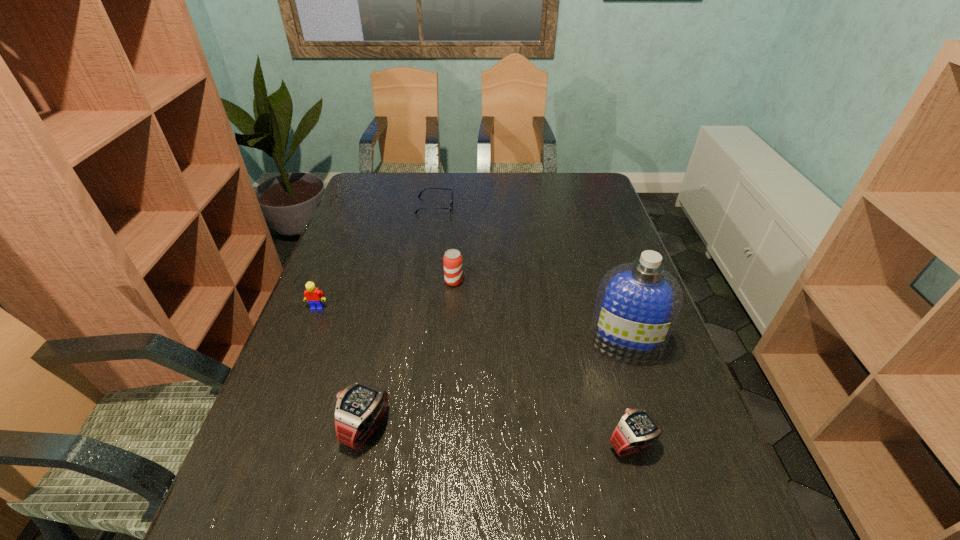
Identify the location of vacant region located on the right of the right watch. Image resolution: width=960 pixels, height=540 pixels. (687, 444).

Where is `vacant space located on the front-facing side of the spectacles`? The image size is (960, 540). vacant space located on the front-facing side of the spectacles is located at coordinates (520, 205).

In order to click on free space located on the back of the fifth nearest object in this screenshot , I will do `click(458, 218)`.

Locate an element on the screen. The image size is (960, 540). vacant space positioned 0.100m on the left of the cleansing agent is located at coordinates (548, 343).

At what (x,y) coordinates should I click in order to perform the action: click on vacant space located 0.300m on the front-facing side of the leftmost object. Please return your answer as a coordinate pair (x, y). The height and width of the screenshot is (540, 960). Looking at the image, I should click on (277, 410).

Locate an element on the screen. The image size is (960, 540). object that is positioned at the far edge is located at coordinates (450, 208).

You are a GUI agent. You are given a task and a screenshot of the screen. Output one action in this format:
    pyautogui.click(x=<x>, y=<y>)
    Task: Click on the object positioned at the left edge
    Image resolution: width=960 pixels, height=540 pixels.
    Given the screenshot: What is the action you would take?
    click(313, 295)

Find the location of `watch at the right edge`. watch at the right edge is located at coordinates (637, 429).

Identify the location of cleansing agent that is at the right edge. (637, 305).

This screenshot has width=960, height=540. Identify the location of object situated at the near right corner. (637, 429).